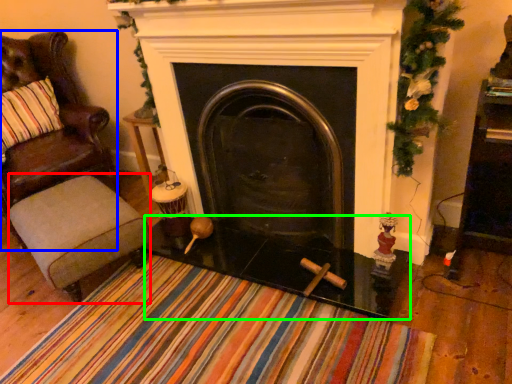
Question: Estimate the real-world distances between objects in this image. Which object is closer to stool (highlighted by a red box), chair (highlighted by a blue box) or glass table (highlighted by a green box)?

Choices:
 (A) chair
 (B) glass table

Answer: (B)